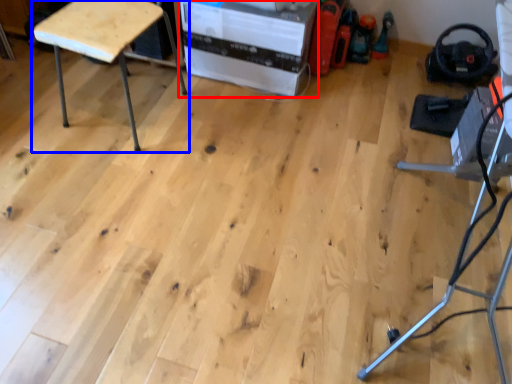
Question: Which object is closer to the camera taking this photo, cardboard box (highlighted by a red box) or furniture (highlighted by a blue box)?

Choices:
 (A) cardboard box
 (B) furniture

Answer: (B)